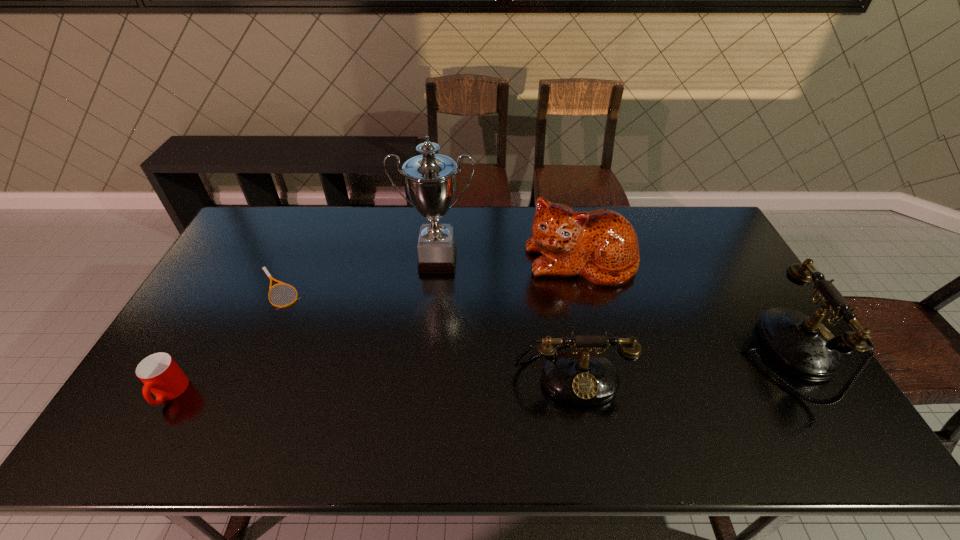
At what (x,y) coordinates should I click in order to perform the action: click on the left telephone. Please return your answer as a coordinate pair (x, y). The image size is (960, 540). Looking at the image, I should click on (576, 378).

At what (x,y) coordinates should I click in order to perform the action: click on the third shortest object. Please return your answer as a coordinate pair (x, y). Looking at the image, I should click on (576, 378).

Where is `the right telephone`? Image resolution: width=960 pixels, height=540 pixels. the right telephone is located at coordinates click(800, 344).

What are the coordinates of `the taller telephone` in the screenshot? It's located at (800, 344).

Where is `the shortest object`? Image resolution: width=960 pixels, height=540 pixels. the shortest object is located at coordinates 271,278.

Where is `tennis racket`? The image size is (960, 540). tennis racket is located at coordinates (271, 278).

Where is `the tallest object`? the tallest object is located at coordinates (430, 179).

Locate an element on the screen. the third object from left to right is located at coordinates (430, 179).

Image resolution: width=960 pixels, height=540 pixels. I want to click on cat, so click(601, 245).

Image resolution: width=960 pixels, height=540 pixels. I want to click on cup, so click(x=161, y=375).